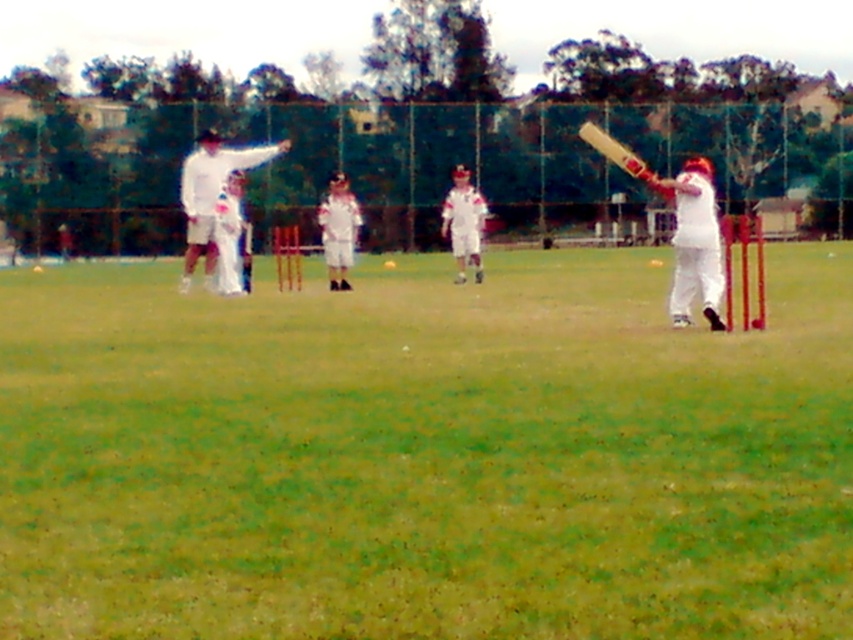
Question: Is white clothed person at left to the left of white clothed figure at left from the viewer's perspective?

Choices:
 (A) yes
 (B) no

Answer: (A)

Question: Estimate the real-world distances between objects in this image. Which object is farther from the white clothed person at left?

Choices:
 (A) green grass at center
 (B) white matte cricket bat at right
 (C) white clothed figure at left

Answer: (B)

Question: From the image, what is the correct spatial relationship of white matte cricket bat at right in relation to white cloth cricket bat at center?

Choices:
 (A) left
 (B) right

Answer: (B)

Question: Among these points, which one is nearest to the camera?

Choices:
 (A) (740, 611)
 (B) (701, 182)
 (C) (218, 237)

Answer: (A)

Question: Among these objects, which one is farthest from the camera?

Choices:
 (A) white matte cricket bat at center
 (B) white clothed figure at left

Answer: (A)

Question: Can you confirm if white matte cricket bat at right is positioned below white matte cricket bat at center?

Choices:
 (A) no
 (B) yes

Answer: (B)